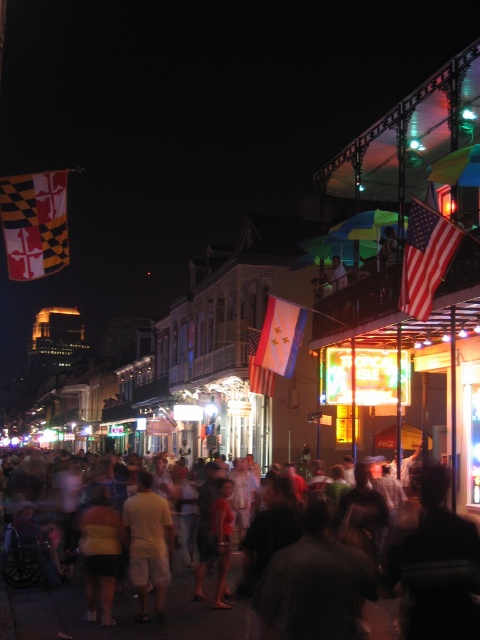
Does red and white fabric flag at left lie in front of light beige shorts at center?

Yes, red and white fabric flag at left is in front of light beige shorts at center.

Is red and white fabric flag at left shorter than light beige shorts at center?

Indeed, red and white fabric flag at left has a lesser height compared to light beige shorts at center.

Describe the element at coordinates (35, 224) in the screenshot. I see `red and white fabric flag at left` at that location.

Find the location of `red and white fabric flag at left`. red and white fabric flag at left is located at coordinates (35, 224).

In order to click on blurred human crowd at center in this screenshot , I will do `click(113, 614)`.

Can you confirm if blurred human crowd at center is bigger than matte white flag at center?

Yes, blurred human crowd at center is bigger than matte white flag at center.

The height and width of the screenshot is (640, 480). Describe the element at coordinates (113, 614) in the screenshot. I see `blurred human crowd at center` at that location.

This screenshot has width=480, height=640. I want to click on blurred human crowd at center, so click(x=113, y=614).

Can you confirm if light beige shorts at center is bigger than matte white flag at center?

Incorrect, light beige shorts at center is not larger than matte white flag at center.

Between point (160, 524) and point (264, 387), which one is positioned behind?

The point (264, 387) is more distant.

Between point (155, 516) and point (255, 392), which one is positioned in front?

Point (155, 516) is in front.

Locate an element on the screen. This screenshot has width=480, height=640. light beige shorts at center is located at coordinates (148, 544).